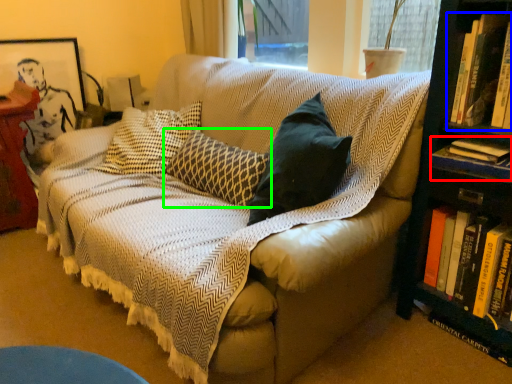
Question: Considering the real-world distances, which object is farthest from book (highlighted by a red box)? book (highlighted by a blue box) or pillow (highlighted by a green box)?

Choices:
 (A) book
 (B) pillow

Answer: (B)